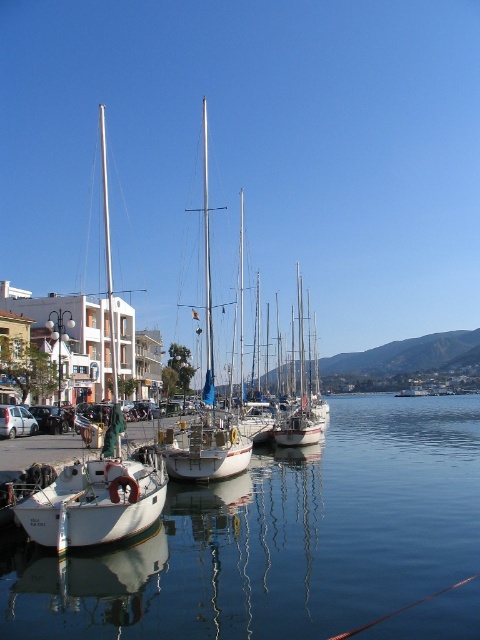
Is the position of clear glass water at lower left more distant than that of white matte sailboat at center?

No, it is not.

Between clear glass water at lower left and white matte sailboat at center, which one has less height?

With less height is clear glass water at lower left.

Which is in front, point (403, 588) or point (207, 308)?

Positioned in front is point (403, 588).

Where is `clear glass water at lower left`? clear glass water at lower left is located at coordinates (280, 538).

Is the position of clear glass water at lower left more distant than that of white matte sailboat at left?

No, it is not.

Based on the photo, can you confirm if clear glass water at lower left is positioned above white matte sailboat at left?

Actually, clear glass water at lower left is below white matte sailboat at left.

Is point (432, 554) positioned in front of point (104, 136)?

Yes, point (432, 554) is in front of point (104, 136).

Where is `clear glass water at lower left`? This screenshot has width=480, height=640. clear glass water at lower left is located at coordinates click(280, 538).

Who is lower down, white matte sailboat at left or white matte sailboat at center?

white matte sailboat at center

From the picture: Is the position of white matte sailboat at left less distant than that of white matte sailboat at center?

Yes, it is.

Is point (54, 509) more distant than point (226, 435)?

That is False.

Locate an element on the screen. The height and width of the screenshot is (640, 480). white matte sailboat at left is located at coordinates (98, 467).